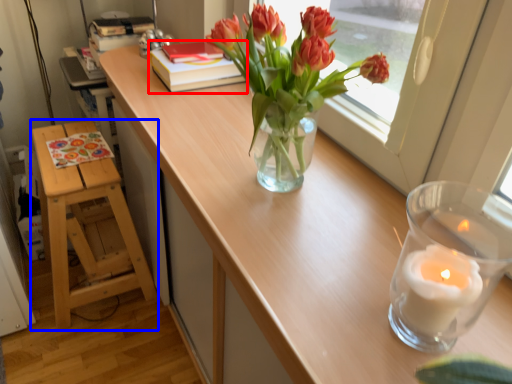
Question: Which object appears closest to the camera in this image, book (highlighted by a red box) or furniture (highlighted by a blue box)?

Choices:
 (A) book
 (B) furniture

Answer: (B)